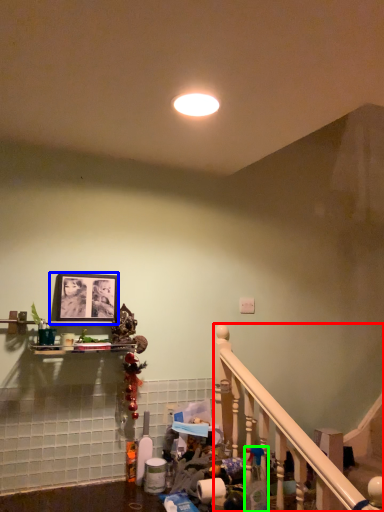
Question: Estimate the real-world distances between objects in this image. Which object is closer to rail (highlighted by a red box), picture frame (highlighted by a blue box) or cleaning product (highlighted by a green box)?

Choices:
 (A) picture frame
 (B) cleaning product

Answer: (B)